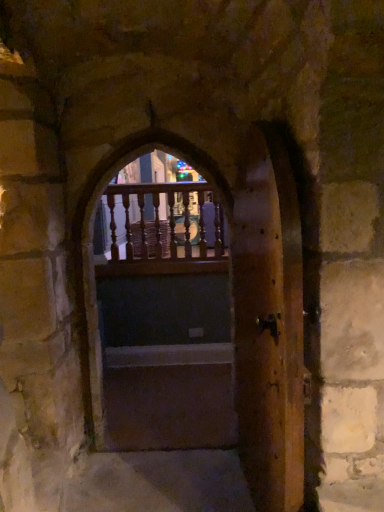
Where is `free area behind wooden door at center, the second door positioned from the right`? The width and height of the screenshot is (384, 512). free area behind wooden door at center, the second door positioned from the right is located at coordinates (179, 402).